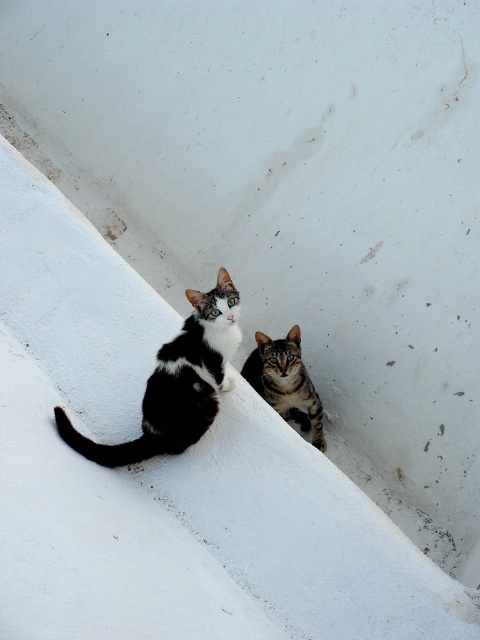
You are a photographer aiming to capture a closeup of the cats. Which cat, the black and white fur cat at center or the striped fur cat at center, should you focus on to ensure the subject is in sharp focus without adjusting your camera position?

You should focus on the black and white fur cat at center because it is closer to the viewer than the striped fur cat at center, making it the primary subject in focus.

In the scene shown: You are standing in front of the wall with two cats. You want to touch the cat at point (128, 464) first and then the cat at point (254, 374). Which cat will you reach first?

The cat at point (128, 464) is closer to you than the cat at point (254, 374), so you will reach it first.